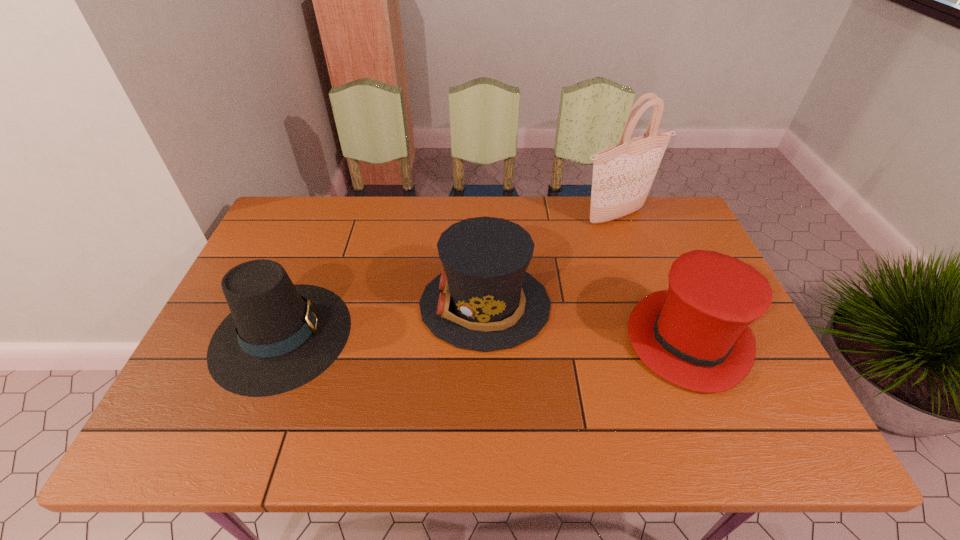
This screenshot has width=960, height=540. I want to click on vacant space that satisfies the following two spatial constraints: 1. with goggles on the front of the second object from left to right; 2. on the left side of the rightmost hat, so click(x=486, y=341).

This screenshot has height=540, width=960. Find the location of `vacant region that satisfies the following two spatial constraints: 1. on the front side of the rightmost hat; 2. on the right side of the shopping bag`. vacant region that satisfies the following two spatial constraints: 1. on the front side of the rightmost hat; 2. on the right side of the shopping bag is located at coordinates (660, 341).

Locate an element on the screen. free space that satisfies the following two spatial constraints: 1. with goggles on the front of the second hat from left to right; 2. on the left side of the rightmost hat is located at coordinates (486, 341).

At what (x,y) coordinates should I click in order to perform the action: click on free location that satisfies the following two spatial constraints: 1. on the back side of the rightmost hat; 2. with goggles on the front of the third object from right to left. Please return your answer as a coordinate pair (x, y). The width and height of the screenshot is (960, 540). Looking at the image, I should click on (674, 305).

The width and height of the screenshot is (960, 540). Find the location of `blank area in the image that satisfies the following two spatial constraints: 1. on the front-facing side of the leftmost hat; 2. on the left side of the rightmost hat`. blank area in the image that satisfies the following two spatial constraints: 1. on the front-facing side of the leftmost hat; 2. on the left side of the rightmost hat is located at coordinates (279, 341).

Where is `free location that satisfies the following two spatial constraints: 1. with goggles on the front of the second hat from left to right; 2. on the right side of the rightmost hat`? free location that satisfies the following two spatial constraints: 1. with goggles on the front of the second hat from left to right; 2. on the right side of the rightmost hat is located at coordinates (486, 341).